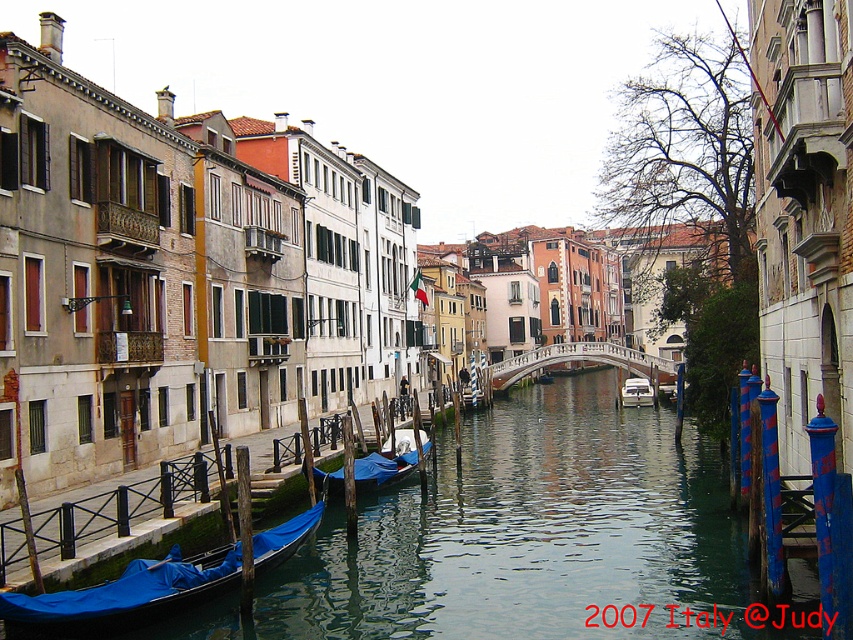
Looking at this image, you are standing on a bridge overlooking the canal and want to take a photo. There are two points of interest marked in the scene. The first is at point (177,589) and the second at point (260,476). Which point is closer to you so that you can focus your camera lens properly?

Point (177,589) is closer to the viewer than point (260,476), so you should focus your camera lens on that point first.